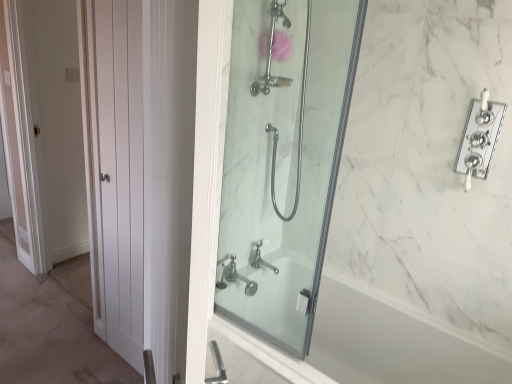
Question: From the image's perspective, does polished chrome faucet at upper right appear lower than chrome metallic faucet at center?

Choices:
 (A) yes
 (B) no

Answer: (B)

Question: Is polished chrome faucet at upper right with chrome metallic faucet at center?

Choices:
 (A) yes
 (B) no

Answer: (B)

Question: Can you confirm if polished chrome faucet at upper right is bigger than chrome metallic faucet at center?

Choices:
 (A) yes
 (B) no

Answer: (B)

Question: Can you confirm if polished chrome faucet at upper right is thinner than chrome metallic faucet at center?

Choices:
 (A) no
 (B) yes

Answer: (B)

Question: Does polished chrome faucet at upper right appear on the left side of chrome metallic faucet at center?

Choices:
 (A) yes
 (B) no

Answer: (B)

Question: Considering the positions of polished chrome faucet at upper right and chrome metallic faucet at center in the image, is polished chrome faucet at upper right taller or shorter than chrome metallic faucet at center?

Choices:
 (A) short
 (B) tall

Answer: (B)

Question: From a real-world perspective, is polished chrome faucet at upper right above or below chrome metallic faucet at center?

Choices:
 (A) below
 (B) above

Answer: (B)

Question: Is polished chrome faucet at upper right inside the boundaries of chrome metallic faucet at center, or outside?

Choices:
 (A) inside
 (B) outside

Answer: (B)

Question: In the image, is polished chrome faucet at upper right on the left side or the right side of chrome metallic faucet at center?

Choices:
 (A) right
 (B) left

Answer: (A)

Question: In terms of width, does white marble bathtub at center look wider or thinner when compared to chrome metallic faucet at center?

Choices:
 (A) thin
 (B) wide

Answer: (B)

Question: In terms of height, does white marble bathtub at center look taller or shorter compared to chrome metallic faucet at center?

Choices:
 (A) tall
 (B) short

Answer: (A)

Question: Relative to chrome metallic faucet at center, is white marble bathtub at center in front or behind?

Choices:
 (A) front
 (B) behind

Answer: (A)

Question: Is point (426, 334) positioned closer to the camera than point (263, 264)?

Choices:
 (A) farther
 (B) closer

Answer: (B)

Question: Considering the positions of polished chrome faucet at upper right and clear glass shower at center in the image, is polished chrome faucet at upper right wider or thinner than clear glass shower at center?

Choices:
 (A) thin
 (B) wide

Answer: (A)

Question: Is polished chrome faucet at upper right bigger or smaller than clear glass shower at center?

Choices:
 (A) big
 (B) small

Answer: (B)